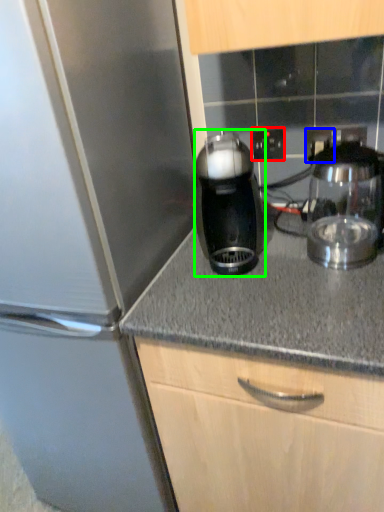
Question: Which object is the farthest from electric outlet (highlighted by a red box)? Choose among these: electric outlet (highlighted by a blue box) or kitchen appliance (highlighted by a green box).

Choices:
 (A) electric outlet
 (B) kitchen appliance

Answer: (B)